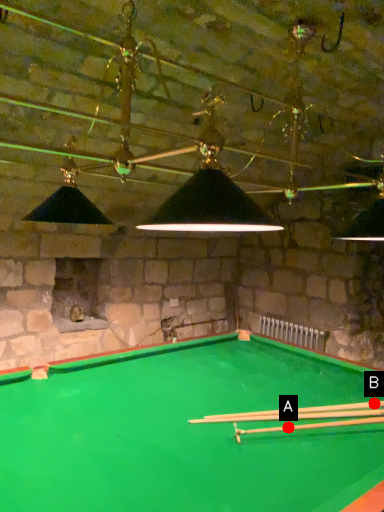
Question: Two points are circled on the image, labeled by A and B beside each circle. Which of the following is the closest to the observer?

Choices:
 (A) A is closer
 (B) B is closer

Answer: (A)